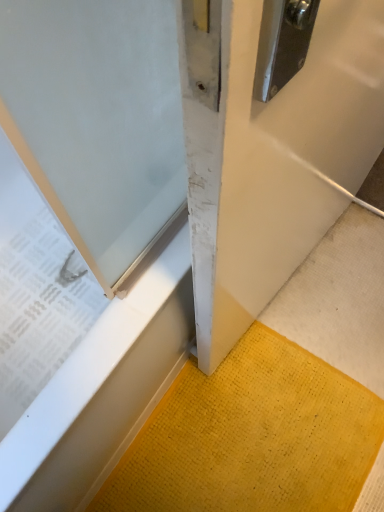
Question: From a real-world perspective, is white matte door at center physically located above or below yellow textured mat at lower right?

Choices:
 (A) above
 (B) below

Answer: (A)

Question: Is white matte door at center bigger or smaller than yellow textured mat at lower right?

Choices:
 (A) big
 (B) small

Answer: (A)

Question: Does point (238, 242) appear closer or farther from the camera than point (190, 441)?

Choices:
 (A) farther
 (B) closer

Answer: (B)

Question: Considering the relative positions of yellow textured mat at lower right and white matte door at center in the image provided, is yellow textured mat at lower right to the left or to the right of white matte door at center?

Choices:
 (A) right
 (B) left

Answer: (B)

Question: Looking at their shapes, would you say yellow textured mat at lower right is wider or thinner than white matte door at center?

Choices:
 (A) wide
 (B) thin

Answer: (A)

Question: Is yellow textured mat at lower right inside or outside of white matte door at center?

Choices:
 (A) outside
 (B) inside

Answer: (A)

Question: Considering the positions of yellow textured mat at lower right and white matte door at center in the image, is yellow textured mat at lower right taller or shorter than white matte door at center?

Choices:
 (A) short
 (B) tall

Answer: (A)